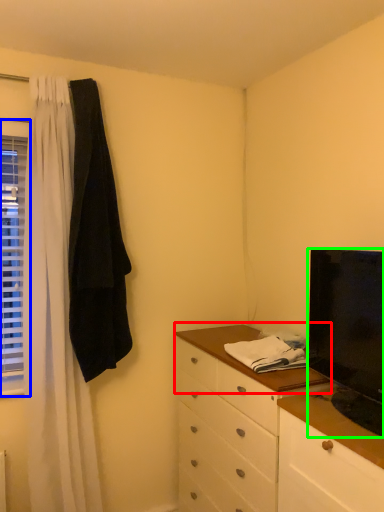
Question: Which is farther away from counter top (highlighted by a red box)? window (highlighted by a blue box) or television (highlighted by a green box)?

Choices:
 (A) window
 (B) television

Answer: (A)